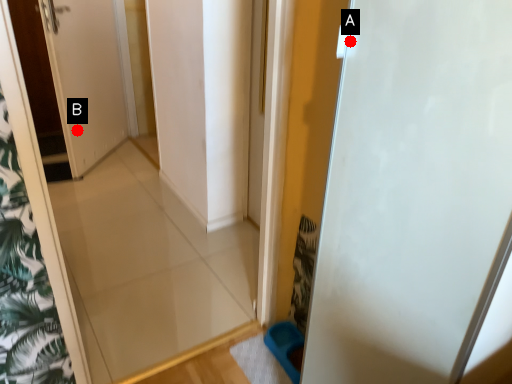
Question: Two points are circled on the image, labeled by A and B beside each circle. Which point is farther to the camera?

Choices:
 (A) A is further
 (B) B is further

Answer: (B)